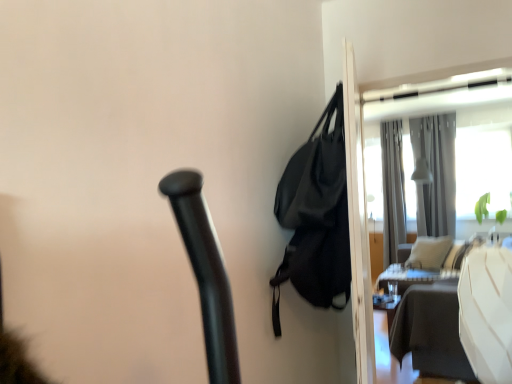
Question: From their relative heights in the image, would you say silky gray curtain at upper right, positioned as the second curtain in left-to-right order, is taller or shorter than white glossy table at right?

Choices:
 (A) short
 (B) tall

Answer: (B)

Question: From the image's perspective, is silky gray curtain at upper right, acting as the 1th curtain starting from the right, located above or below white glossy table at right?

Choices:
 (A) above
 (B) below

Answer: (A)

Question: Which of these objects is positioned closest to the silky gray curtain at upper right, positioned as the second curtain in left-to-right order?

Choices:
 (A) transparent glass screen door at upper right
 (B) white glossy table at right
 (C) black matte bag at upper right
 (D) gray fabric curtain at upper right, acting as the 2th curtain starting from the right

Answer: (D)

Question: Estimate the real-world distances between objects in this image. Which object is closer to the white glossy table at right?

Choices:
 (A) transparent glass screen door at upper right
 (B) gray fabric curtain at upper right, which appears as the first curtain when viewed from the left
 (C) black matte bag at upper right
 (D) silky gray curtain at upper right, positioned as the second curtain in left-to-right order

Answer: (B)